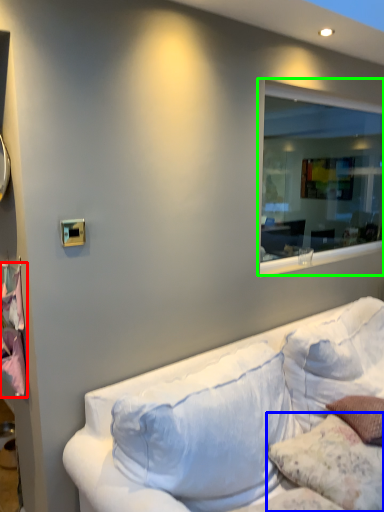
Question: Based on their relative distances, which object is nearer to sheet (highlighted by a red box)? Choose from pillow (highlighted by a blue box) and window (highlighted by a green box).

Choices:
 (A) pillow
 (B) window

Answer: (A)